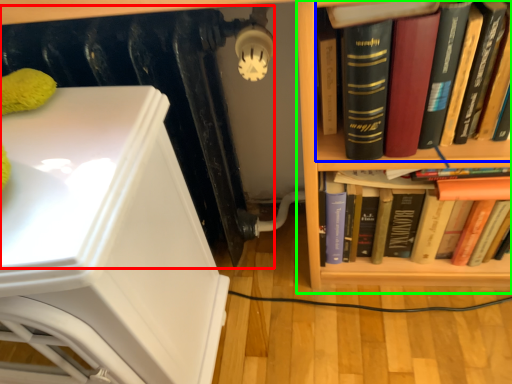
Question: Based on their relative distances, which object is farther from radiator (highlighted by a red box)? Choose from book (highlighted by a blue box) and bookcase (highlighted by a green box).

Choices:
 (A) book
 (B) bookcase

Answer: (A)